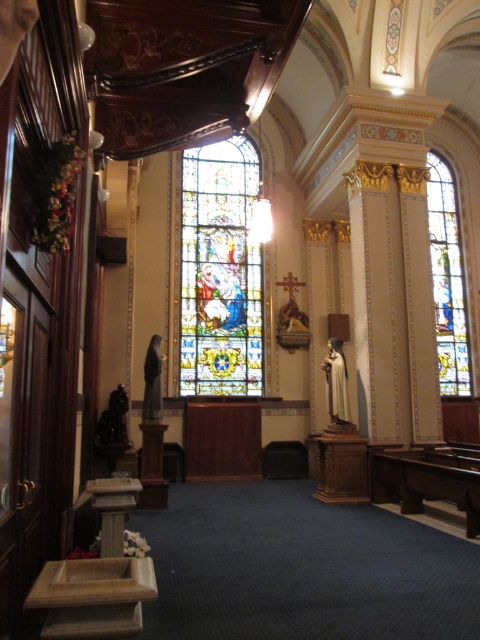
You are standing in the church and want to take a photo of the stained glass windows. If you face the stained glass window at center and the stained glass window at right, which one is to your right?

The stained glass window at right is to your right because the stained glass window at center is positioned on the left side of it.

Consider the image. You are an architect analyzing the church interior. You observe the stained glass window at center and the stained glass window at right. Which one has a greater height?

The stained glass window at right is taller than the stained glass window at center, so the stained glass window at right has a greater height.